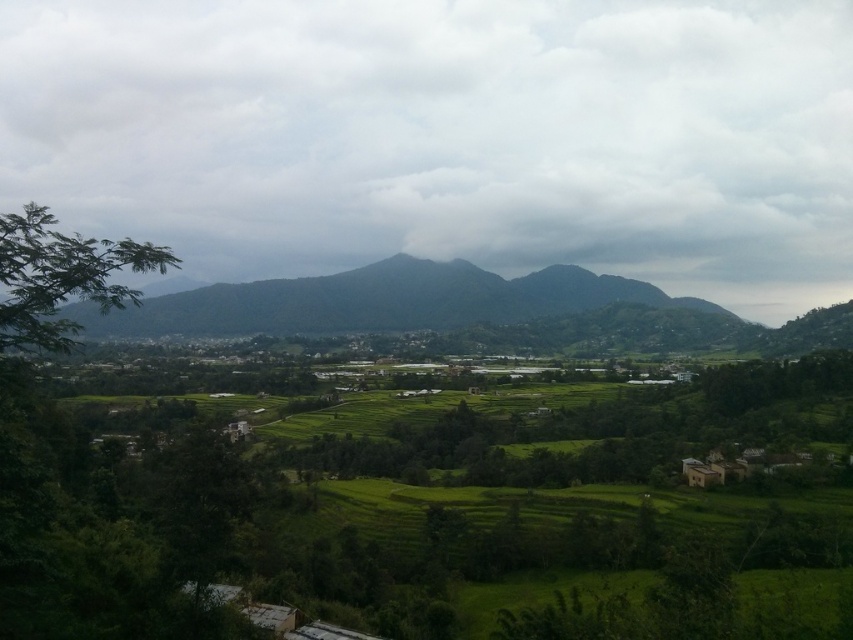
You are standing in the middle of the terraced fields and looking up. What do you see at the point with coordinates point (447, 136)?

At point (447, 136), you see cloudy gray sky at upper center.

You are standing in the middle of the terraced fields and looking towards the mountains. Which object is higher in your view, the cloudy gray sky at upper center or the green leafy tree at left?

The cloudy gray sky at upper center is higher in your view than the green leafy tree at left because it is positioned above it.

You are a photographer planning to capture the rural landscape. You want to ensure that both the cloudy gray sky at upper center and the green leafy tree at left are visible in your shot. Given their sizes, which object will occupy more of the frame?

The cloudy gray sky at upper center is bigger than the green leafy tree at left, so it will occupy more of the frame.